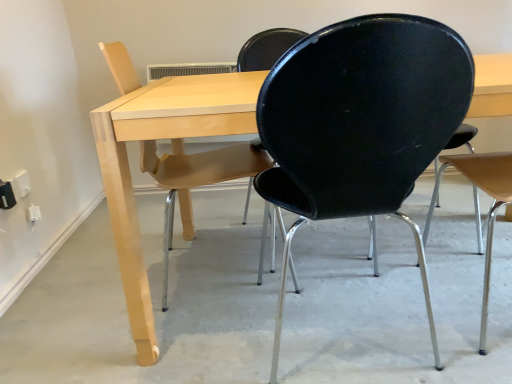
Locate an element on the screen. Image resolution: width=512 pixels, height=384 pixels. free location in front of matte wood chair at left, the 3th chair positioned from the right is located at coordinates (174, 345).